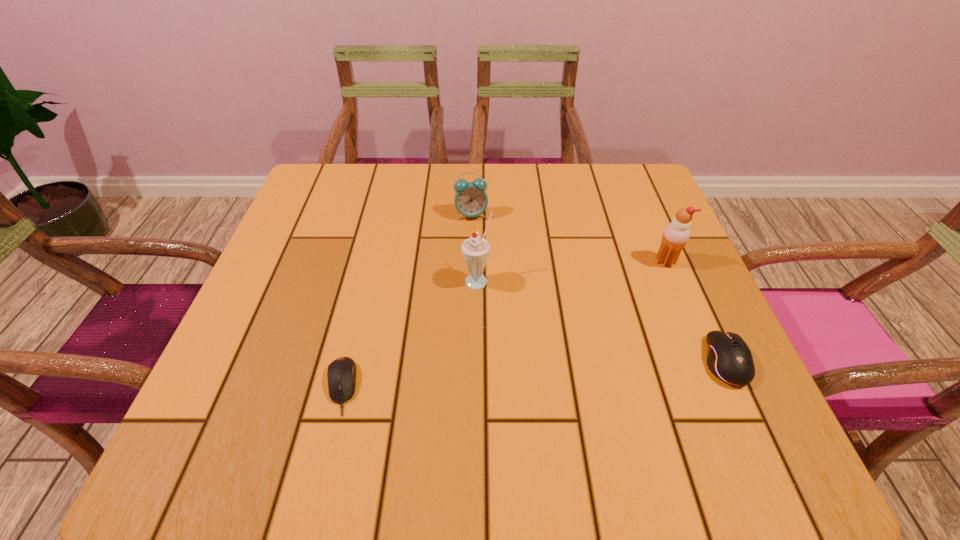
I want to click on vacant point located on the straw side of the milkshake, so click(501, 308).

Where is `free space located on the straw side of the milkshake`? This screenshot has width=960, height=540. free space located on the straw side of the milkshake is located at coordinates (581, 402).

Find the location of a particular element. Image resolution: width=960 pixels, height=540 pixels. vacant region located 0.130m on the straw side of the milkshake is located at coordinates (521, 333).

This screenshot has height=540, width=960. Identify the location of vacant space located at the front with a straw on the icecream. (536, 364).

You are a GUI agent. You are given a task and a screenshot of the screen. Output one action in this format:
    pyautogui.click(x=<x>, y=<y>)
    Task: Click on the vacant space situated at the front with a straw on the icecream
    The image size is (960, 540).
    Given the screenshot: What is the action you would take?
    pyautogui.click(x=552, y=352)

Identify the location of vacant space located 0.290m at the front with a straw on the icecream. Image resolution: width=960 pixels, height=540 pixels. (570, 338).

Locate an element on the screen. Image resolution: width=960 pixels, height=540 pixels. free location located on the face of the alarm clock is located at coordinates (515, 302).

The image size is (960, 540). I want to click on vacant space located on the face of the alarm clock, so click(535, 345).

Locate an element on the screen. This screenshot has height=540, width=960. free spot located 0.060m on the face of the alarm clock is located at coordinates (484, 237).

Image resolution: width=960 pixels, height=540 pixels. What are the coordinates of `object positioned at the far edge` in the screenshot? It's located at (470, 198).